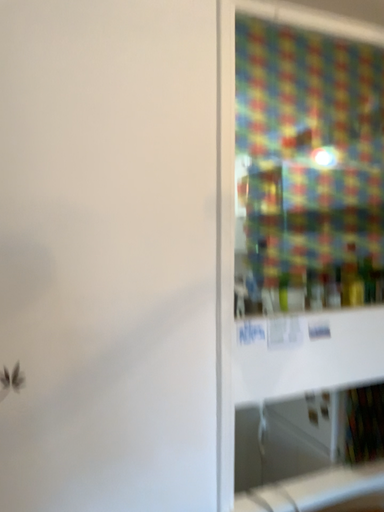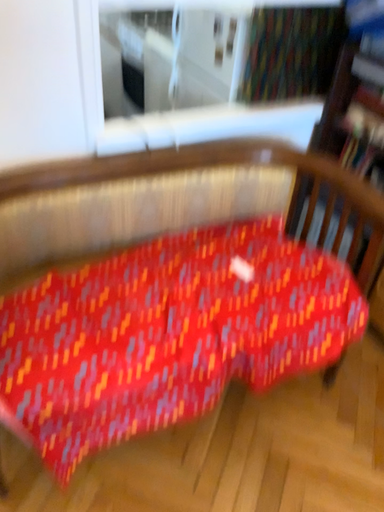
Question: Which way did the camera rotate in the video?

Choices:
 (A) rotated upward
 (B) rotated downward

Answer: (B)